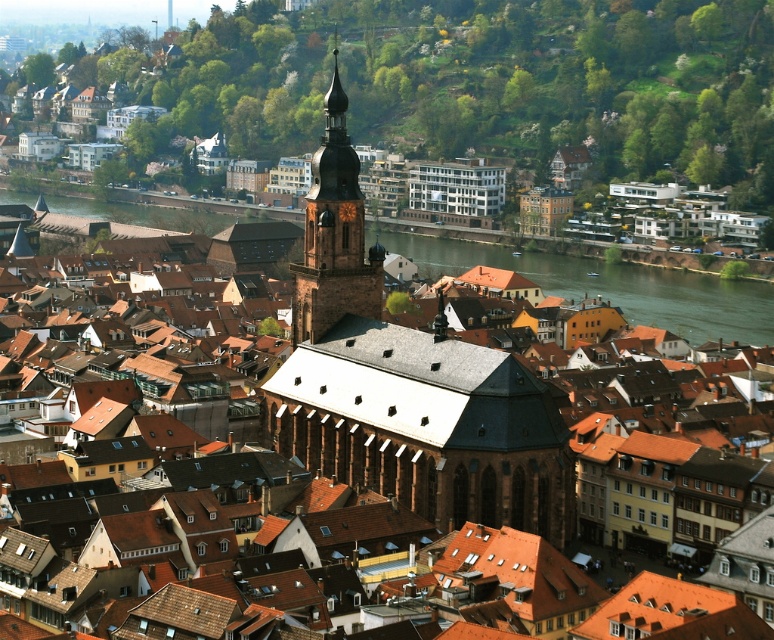
Question: Is brown stone church at center positioned before brown stone bell tower at center?

Choices:
 (A) yes
 (B) no

Answer: (A)

Question: Can you confirm if green water at center is positioned above brown stone bell tower at center?

Choices:
 (A) no
 (B) yes

Answer: (A)

Question: Can you confirm if brown stone church at center is bigger than green water at center?

Choices:
 (A) no
 (B) yes

Answer: (A)

Question: Which point is closer to the camera taking this photo?

Choices:
 (A) (536, 412)
 (B) (368, 262)

Answer: (A)

Question: Which point is farther to the camera?

Choices:
 (A) brown stone bell tower at center
 (B) brown stone church at center
 (C) green water at center

Answer: (C)

Question: Which point is closer to the camera taking this photo?

Choices:
 (A) (682, 333)
 (B) (519, 387)

Answer: (B)